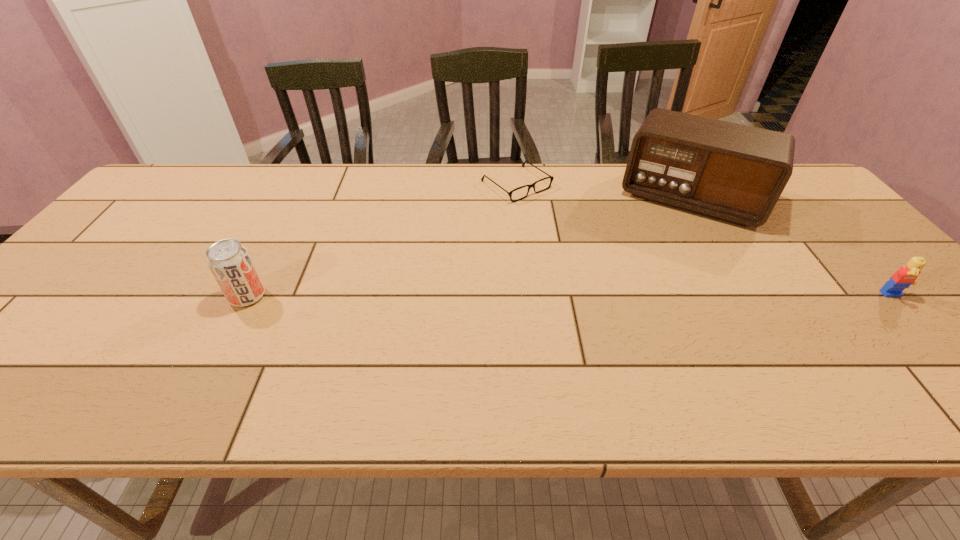
Where is `free space located 0.090m on the front-facing side of the third object from right to left`? free space located 0.090m on the front-facing side of the third object from right to left is located at coordinates (558, 216).

Image resolution: width=960 pixels, height=540 pixels. Find the location of `free space located on the front-facing side of the third object from right to left`. free space located on the front-facing side of the third object from right to left is located at coordinates (554, 213).

The image size is (960, 540). What are the coordinates of `vacant area located on the front-facing side of the third object from right to left` in the screenshot? It's located at (635, 274).

The width and height of the screenshot is (960, 540). I want to click on free space located on the front-facing side of the tallest object, so [x=647, y=293].

You are a GUI agent. You are given a task and a screenshot of the screen. Output one action in this format:
    pyautogui.click(x=<x>, y=<y>)
    Task: Click on the vacant space located on the front-facing side of the tallest object
    The height and width of the screenshot is (540, 960).
    Given the screenshot: What is the action you would take?
    pyautogui.click(x=644, y=301)

Locate an element on the screen. This screenshot has height=540, width=960. vacant region located on the front-facing side of the tallest object is located at coordinates (662, 254).

The height and width of the screenshot is (540, 960). Find the location of `spectacles at the far edge`. spectacles at the far edge is located at coordinates (551, 177).

Find the location of a particular element. radio receiver that is at the far edge is located at coordinates (735, 173).

Find the location of a particular element. object located in the right edge section of the desktop is located at coordinates (904, 277).

The image size is (960, 540). In order to click on vacant space at the far edge of the desktop in this screenshot , I will do `click(427, 166)`.